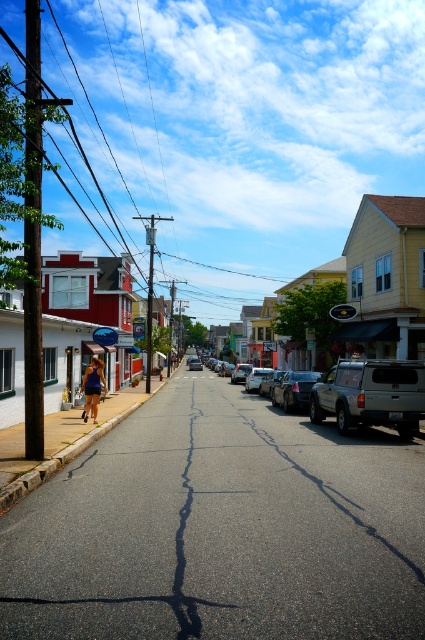
From the picture: You are standing on the street looking at the buildings. There are two points marked on the image. One is at coordinate point (314, 419) and the other at point (93, 401). Which point is closer to you?

Point (93, 401) is closer to you because it is not as far as point (314, 419) which is further away.

You are a delivery person standing on the street and need to place a package on top of the silver metallic suv at center. The package is 1 meter tall. Can you safely place it there without it touching the matte blue shorts at center?

The silver metallic suv at center is taller than the matte blue shorts at center. Since the package is 1 meter tall, it can be placed on top of the silver metallic suv at center without touching the matte blue shorts at center.